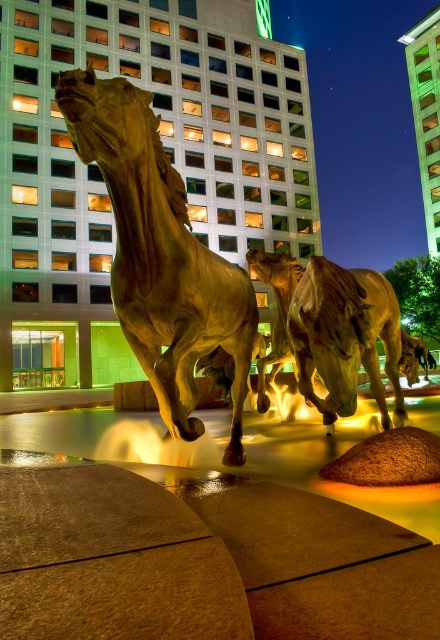
You are an art curator planning to install a spotlight on the tallest horse sculpture in the image. Which horse sculpture should you choose between the gold polished horse at center and the shiny bronze horse at center?

The gold polished horse at center is taller than the shiny bronze horse at center, so you should choose the gold polished horse at center for the spotlight.

You are an art curator planning to install a spotlight on the gold polished horse at center and the shiny bronze horse at center. Since both sculptures are at the center, which one should you aim the spotlight at first to ensure proper illumination without moving the stand?

The gold polished horse at center is above the shiny bronze horse at center, so you should aim the spotlight at the gold polished horse at center first to reach the higher position before adjusting for the lower one.

You are standing in front of the nighttime scene with the horse sculptures and the modern building. You notice two points marked in the image. Which of the two points, point (179, 372) or point (391, 330), is closer to your viewpoint?

Point (179, 372) is closer to the camera than point (391, 330), so the point closer to your viewpoint is point (179, 372).